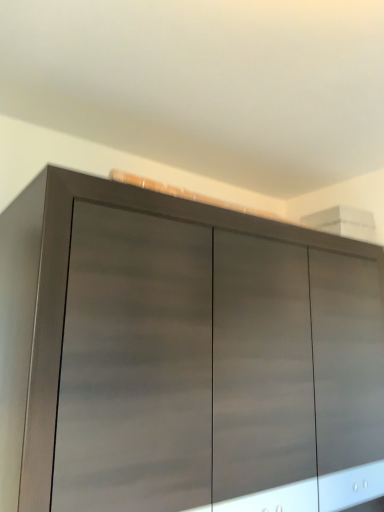
This screenshot has width=384, height=512. I want to click on matte wood cupboard at upper center, so click(183, 356).

The width and height of the screenshot is (384, 512). What do you see at coordinates (183, 356) in the screenshot?
I see `matte wood cupboard at upper center` at bounding box center [183, 356].

Measure the distance between point (29, 379) and camera.

The distance of point (29, 379) from camera is 3.52 feet.

The image size is (384, 512). Find the location of `matte wood cupboard at upper center`. matte wood cupboard at upper center is located at coordinates (183, 356).